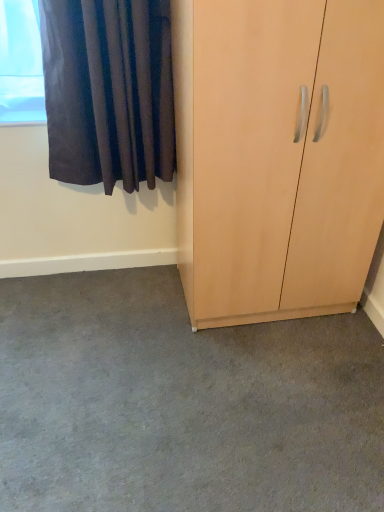
You are a GUI agent. You are given a task and a screenshot of the screen. Output one action in this format:
    pyautogui.click(x=<x>, y=<y>)
    Task: Click on the gray carpet at lower center
    The image size is (384, 512).
    Given the screenshot: What is the action you would take?
    pyautogui.click(x=181, y=403)

Describe the element at coordinates (277, 155) in the screenshot. I see `light wood cupboard at right` at that location.

Find the location of a particular element. This screenshot has width=384, height=512. dark velvet curtain at upper left is located at coordinates (108, 91).

Based on the photo, what's the angular difference between dark velvet curtain at upper left and gray carpet at lower center's facing directions?

dark velvet curtain at upper left and gray carpet at lower center are facing 88.5 degrees away from each other.

Considering the sizes of objects dark velvet curtain at upper left and gray carpet at lower center in the image provided, who is wider, dark velvet curtain at upper left or gray carpet at lower center?

gray carpet at lower center is wider.

From the image's perspective, which one is positioned higher, dark velvet curtain at upper left or gray carpet at lower center?

dark velvet curtain at upper left.

Considering the relative positions of gray carpet at lower center and dark velvet curtain at upper left in the image provided, is gray carpet at lower center to the left or to the right of dark velvet curtain at upper left?

In the image, gray carpet at lower center appears on the right side of dark velvet curtain at upper left.

How many degrees apart are the facing directions of gray carpet at lower center and dark velvet curtain at upper left?

88.5 degrees separate the facing orientations of gray carpet at lower center and dark velvet curtain at upper left.

I want to click on concrete on the right of dark velvet curtain at upper left, so click(x=181, y=403).

Considering the sizes of gray carpet at lower center and dark velvet curtain at upper left in the image, is gray carpet at lower center taller or shorter than dark velvet curtain at upper left?

Considering their sizes, gray carpet at lower center has less height than dark velvet curtain at upper left.

Measure the distance between light wood cupboard at right and dark velvet curtain at upper left.

light wood cupboard at right and dark velvet curtain at upper left are 21.54 inches apart from each other.

Is light wood cupboard at right spatially inside dark velvet curtain at upper left, or outside of it?

light wood cupboard at right is spatially situated outside dark velvet curtain at upper left.

Considering the sizes of objects light wood cupboard at right and dark velvet curtain at upper left in the image provided, who is wider, light wood cupboard at right or dark velvet curtain at upper left?

With larger width is light wood cupboard at right.

Does light wood cupboard at right have a lesser height compared to dark velvet curtain at upper left?

No, light wood cupboard at right is not shorter than dark velvet curtain at upper left.

Considering the sizes of objects light wood cupboard at right and gray carpet at lower center in the image provided, who is taller, light wood cupboard at right or gray carpet at lower center?

Answer: light wood cupboard at right.

From a real-world perspective, relative to gray carpet at lower center, is light wood cupboard at right vertically above or below?

Clearly, from a real-world perspective, light wood cupboard at right is above gray carpet at lower center.

Based on their sizes in the image, would you say light wood cupboard at right is bigger or smaller than gray carpet at lower center?

light wood cupboard at right is bigger than gray carpet at lower center.

Visually, is light wood cupboard at right positioned to the left or to the right of gray carpet at lower center?

From the image, it's evident that light wood cupboard at right is to the right of gray carpet at lower center.

From a real-world perspective, is gray carpet at lower center below light wood cupboard at right?

Yes, from a real-world perspective, gray carpet at lower center is below light wood cupboard at right.

Is gray carpet at lower center far away from light wood cupboard at right?

No, gray carpet at lower center is not far away from light wood cupboard at right.

Is light wood cupboard at right at the back of gray carpet at lower center?

No, gray carpet at lower center is not facing away from light wood cupboard at right.

Does point (103, 275) lie in front of point (332, 118)?

No, it is behind (332, 118).

From the image's perspective, is dark velvet curtain at upper left located above or below light wood cupboard at right?

dark velvet curtain at upper left is above light wood cupboard at right.

Considering the relative sizes of dark velvet curtain at upper left and light wood cupboard at right in the image provided, is dark velvet curtain at upper left bigger than light wood cupboard at right?

No, dark velvet curtain at upper left is not bigger than light wood cupboard at right.

From a real-world perspective, which object stands above the other?

In real-world perspective, dark velvet curtain at upper left is above.

Considering the relative sizes of dark velvet curtain at upper left and light wood cupboard at right in the image provided, is dark velvet curtain at upper left wider than light wood cupboard at right?

In fact, dark velvet curtain at upper left might be narrower than light wood cupboard at right.

In order to click on curtain on the left of gray carpet at lower center in this screenshot , I will do `click(108, 91)`.

The image size is (384, 512). What are the coordinates of `curtain above the gray carpet at lower center (from the image's perspective)` in the screenshot? It's located at (108, 91).

From the image, which object appears to be farther from dark velvet curtain at upper left, gray carpet at lower center or light wood cupboard at right?

gray carpet at lower center is positioned further to the anchor dark velvet curtain at upper left.

Considering their positions, is dark velvet curtain at upper left positioned further to light wood cupboard at right than gray carpet at lower center?

gray carpet at lower center is positioned further to the anchor light wood cupboard at right.

From the image, which object appears to be nearer to dark velvet curtain at upper left, light wood cupboard at right or gray carpet at lower center?

light wood cupboard at right.

Estimate the real-world distances between objects in this image. Which object is closer to gray carpet at lower center, dark velvet curtain at upper left or light wood cupboard at right?

Based on the image, light wood cupboard at right appears to be nearer to gray carpet at lower center.

Based on the photo, from the image, which object appears to be farther from light wood cupboard at right, gray carpet at lower center or dark velvet curtain at upper left?

Among the two, gray carpet at lower center is located further to light wood cupboard at right.

Based on their spatial positions, is light wood cupboard at right or dark velvet curtain at upper left closer to gray carpet at lower center?

light wood cupboard at right lies closer to gray carpet at lower center than the other object.

I want to click on cupboard between dark velvet curtain at upper left and gray carpet at lower center in the up-down direction, so pyautogui.click(x=277, y=155).